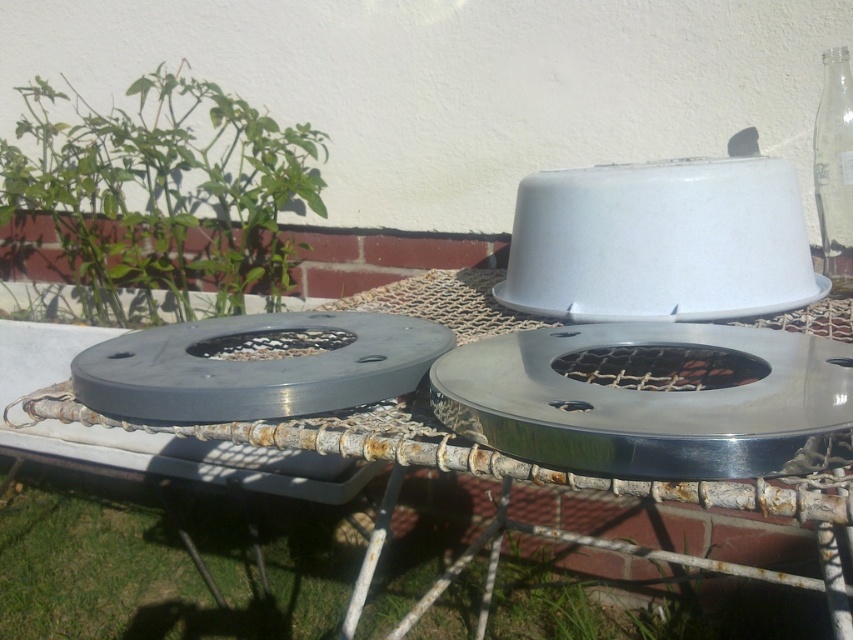
Question: Does matte gray grill at center come behind transparent glass bottle at upper right?

Choices:
 (A) yes
 (B) no

Answer: (B)

Question: Which point is farther from the camera taking this photo?

Choices:
 (A) (843, 134)
 (B) (289, 337)
 (C) (798, 378)
 (D) (212, 500)

Answer: (D)

Question: Considering the relative positions of satin silver grill at center and metallic silver table at center in the image provided, where is satin silver grill at center located with respect to metallic silver table at center?

Choices:
 (A) below
 (B) above

Answer: (B)

Question: Which of these objects is positioned closest to the transparent glass bottle at upper right?

Choices:
 (A) metallic silver table at center
 (B) green grass at lower left

Answer: (A)

Question: Considering the real-world distances, which object is closest to the green grass at lower left?

Choices:
 (A) transparent glass bottle at upper right
 (B) satin silver grill at center

Answer: (B)

Question: Is green grass at lower left to the right of matte gray grill at center from the viewer's perspective?

Choices:
 (A) no
 (B) yes

Answer: (A)